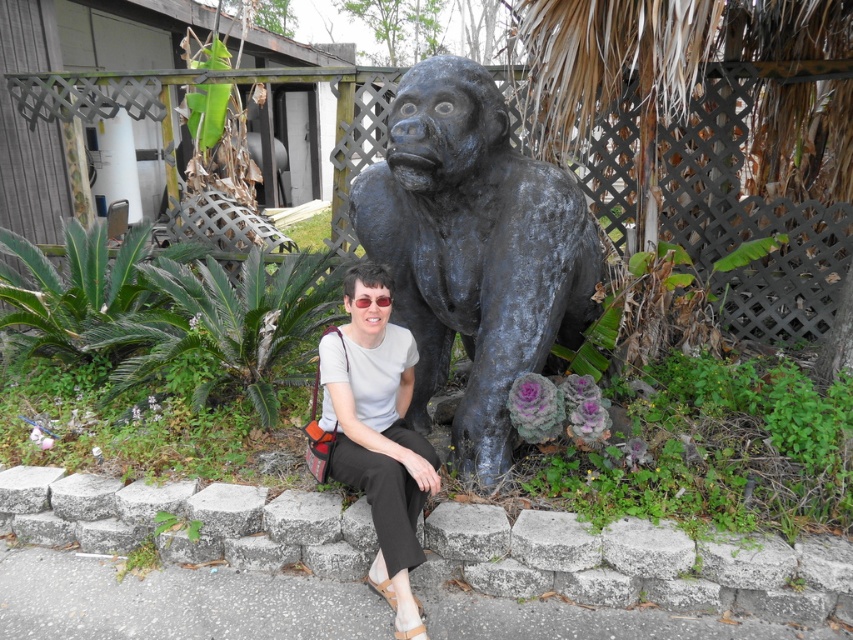
Question: Does gray concrete curb at lower center appear under clear plastic goggles at center?

Choices:
 (A) yes
 (B) no

Answer: (A)

Question: Which object appears closest to the camera in this image?

Choices:
 (A) clear plastic goggles at center
 (B) gray concrete curb at lower center
 (C) matte white shirt at center
 (D) shiny black statue at center

Answer: (C)

Question: Which of the following is the farthest from the observer?

Choices:
 (A) (376, 304)
 (B) (357, 372)
 (C) (688, 605)

Answer: (B)

Question: Which object is the closest to the gray concrete curb at lower center?

Choices:
 (A) clear plastic goggles at center
 (B) matte white shirt at center
 (C) shiny black statue at center

Answer: (B)

Question: Observing the image, what is the correct spatial positioning of gray concrete curb at lower center in reference to shiny black statue at center?

Choices:
 (A) below
 (B) above

Answer: (A)

Question: Is shiny black statue at center below matte white shirt at center?

Choices:
 (A) no
 (B) yes

Answer: (A)